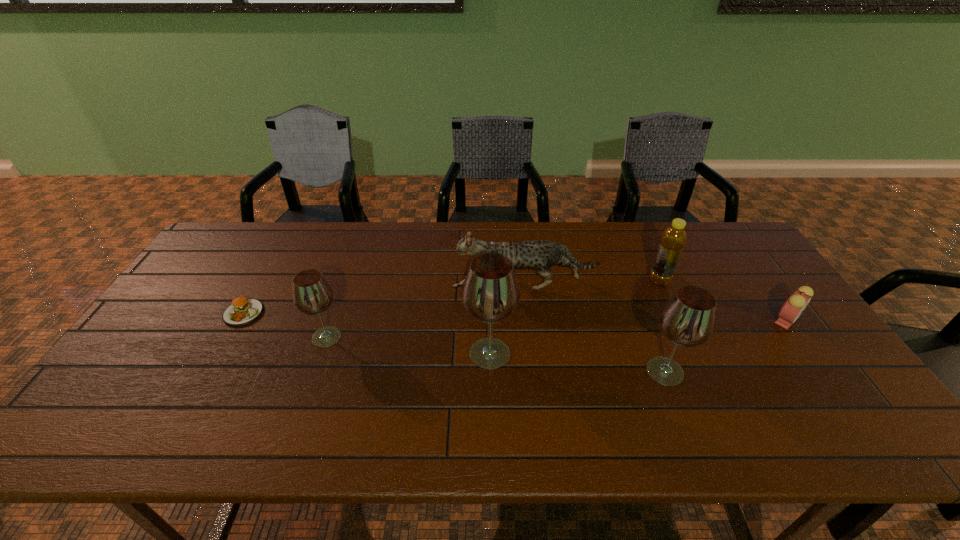
Identify the location of object at the right edge. (792, 308).

Identify the location of vacant area at the far edge of the desktop. (317, 239).

Where is `free region at the near edge`? free region at the near edge is located at coordinates (397, 380).

At what (x,y) coordinates should I click in order to perform the action: click on vacant space at the left edge of the desktop. Please return your answer as a coordinate pair (x, y). The width and height of the screenshot is (960, 540). Looking at the image, I should click on (237, 269).

You are a GUI agent. You are given a task and a screenshot of the screen. Output one action in this format:
    pyautogui.click(x=<x>, y=<y>)
    Task: Click on the vacant space at the right edge of the desktop
    This screenshot has height=540, width=960.
    Given the screenshot: What is the action you would take?
    pyautogui.click(x=748, y=312)

At what (x,y) coordinates should I click in order to perform the action: click on vacant area at the far left corner of the desktop. Please return your answer as a coordinate pair (x, y). The width and height of the screenshot is (960, 540). Looking at the image, I should click on (229, 234).

Image resolution: width=960 pixels, height=540 pixels. In the image, there is a desktop. Find the location of `vacant area at the near left corner`. vacant area at the near left corner is located at coordinates (131, 385).

The width and height of the screenshot is (960, 540). I want to click on vacant area at the far right corner of the desktop, so click(704, 224).

Identify the location of free space between the leftmost object and the second shortest wineglass. (454, 342).

This screenshot has height=540, width=960. I want to click on free space between the second wineglass from left to right and the leftmost object, so click(367, 333).